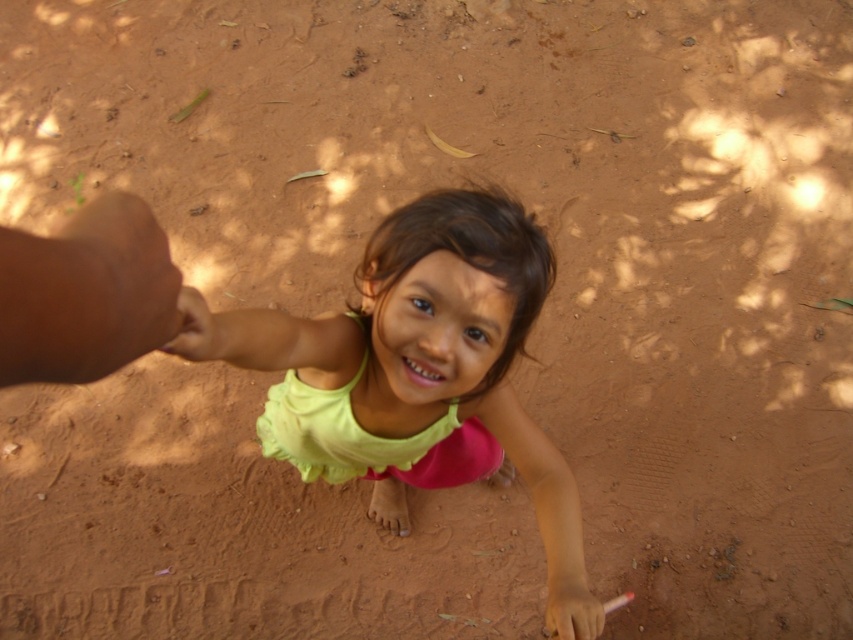
The child is holding an object in their hand. Which one is wider between the pink matte toothbrush at lower center and the light brown skin at lower left?

The pink matte toothbrush at lower center is wider than the light brown skin at lower left according to the description.

You are a photographer taking a picture of the child. You notice two points in the scene at coordinates point (401, 236) and point (180, 298). Which point is closer to your camera?

Point (180, 298) is closer to the camera because the description states that point (401, 236) is further to the camera than point (180, 298).